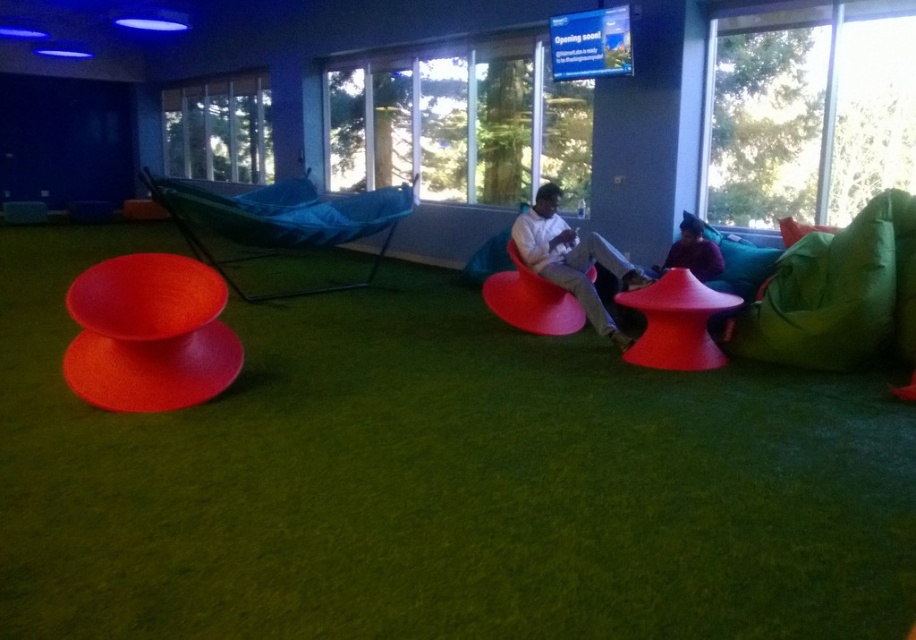
Question: Can you confirm if blue fabric hammock at center is smaller than matte red armchair at center?

Choices:
 (A) yes
 (B) no

Answer: (B)

Question: Which object is closer to the camera taking this photo?

Choices:
 (A) matte red stool at center
 (B) matte red armchair at center

Answer: (A)

Question: Which point is farther to the camera?

Choices:
 (A) (804, 300)
 (B) (707, 296)
 (C) (101, 280)

Answer: (A)

Question: Does green fabric bean bag at right come in front of matte red armchair at center?

Choices:
 (A) yes
 (B) no

Answer: (A)

Question: Which object is the farthest from the matte red stool at lower left?

Choices:
 (A) blue fabric hammock at center
 (B) matte white sweater at center
 (C) green fabric bean bag at right
 (D) matte red stool at center

Answer: (C)

Question: Does matte red stool at lower left appear on the right side of matte red stool at center?

Choices:
 (A) no
 (B) yes

Answer: (A)